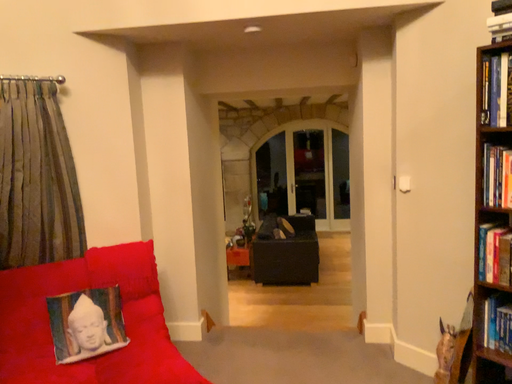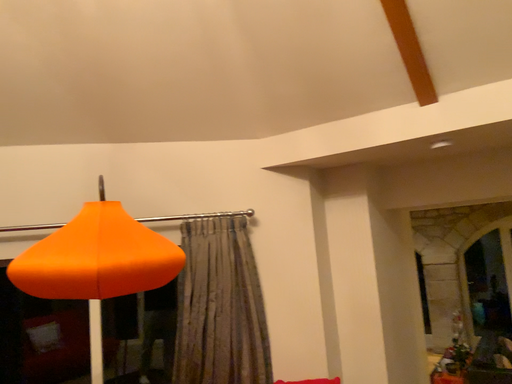
Question: Which way did the camera rotate in the video?

Choices:
 (A) rotated downward
 (B) rotated upward

Answer: (B)